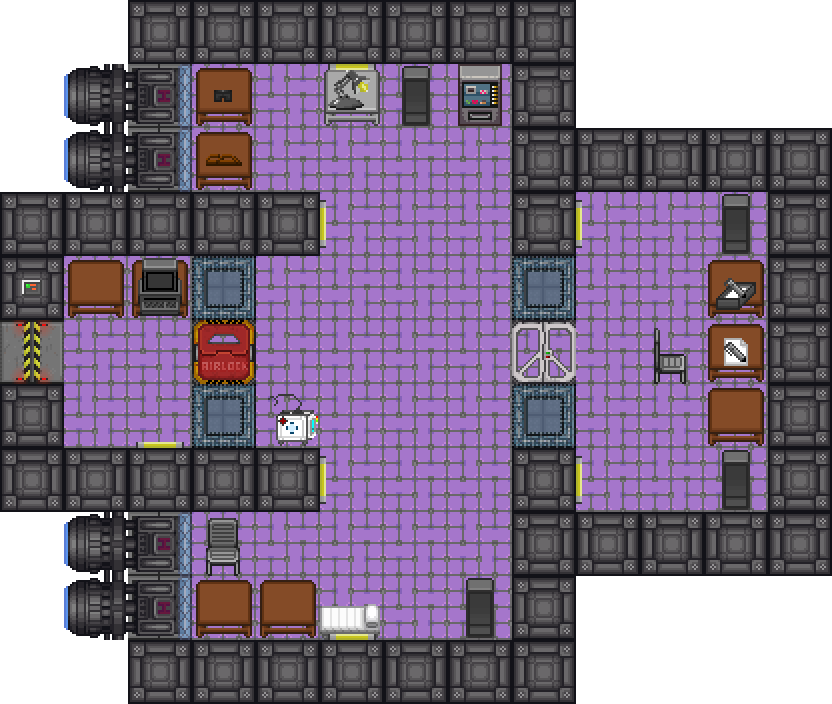
Find the location of `round rooms`. round rooms is located at coordinates (83, 612), (80, 545), (82, 139), (78, 84).